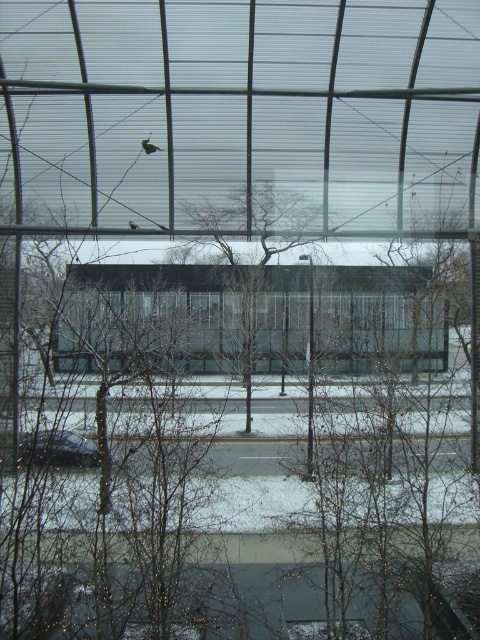
You are standing in front of the large glass window and notice two points marked on the glass. The first point is at coordinates point [289,243] and the second is at point [69,452]. Which point is closer to you?

Point [69,452] is closer to you because it is in front of point [289,243].

Looking at this image, you are an architect designing a new building and want to ensure the transparent glass window at center allows a clear view of the bare branches at center outside. Based on the scene, can you determine if the window is wide enough to frame the branches properly?

The transparent glass window at center might be wider than bare branches at center, so it is likely wide enough to frame the branches properly.